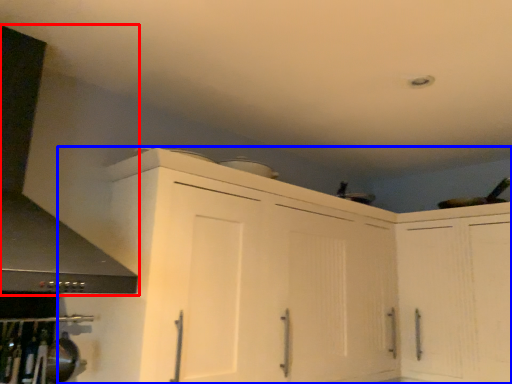
Question: Among these objects, which one is nearest to the camera, exhaust hood (highlighted by a red box) or cabinetry (highlighted by a blue box)?

Choices:
 (A) exhaust hood
 (B) cabinetry

Answer: (A)